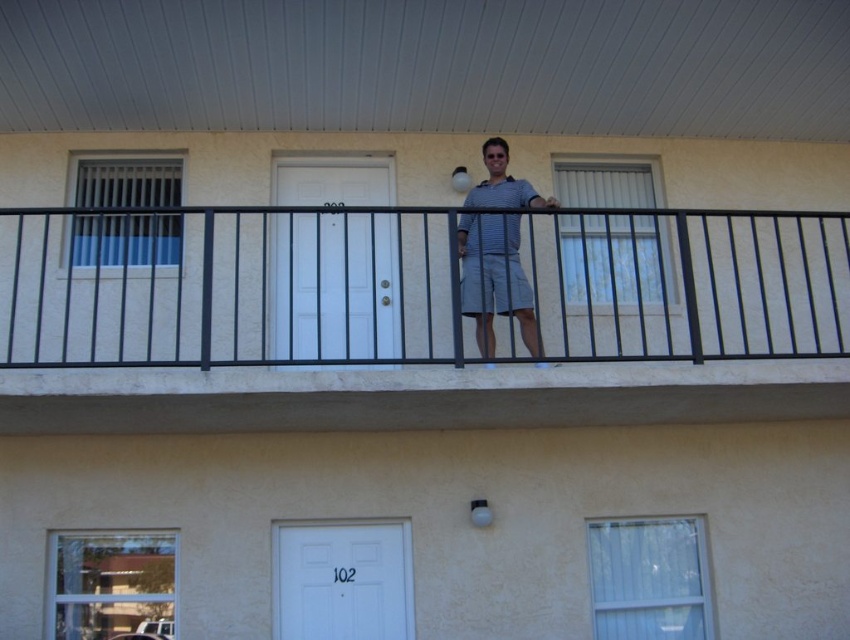
Question: Which is nearer to the black metal railing at upper center?

Choices:
 (A) striped cotton shirt at center
 (B) striped fabric shorts at center

Answer: (B)

Question: Is the position of black metal railing at upper center more distant than that of striped fabric shorts at center?

Choices:
 (A) no
 (B) yes

Answer: (B)

Question: Which point is closer to the camera?

Choices:
 (A) striped fabric shorts at center
 (B) black metal railing at upper center
 (C) striped cotton shirt at center

Answer: (A)

Question: Is black metal railing at upper center wider than striped fabric shorts at center?

Choices:
 (A) yes
 (B) no

Answer: (A)

Question: Which of the following is the farthest from the observer?

Choices:
 (A) (462, 285)
 (B) (511, 189)
 (C) (695, 307)

Answer: (B)

Question: Is black metal railing at upper center below striped cotton shirt at center?

Choices:
 (A) no
 (B) yes

Answer: (B)